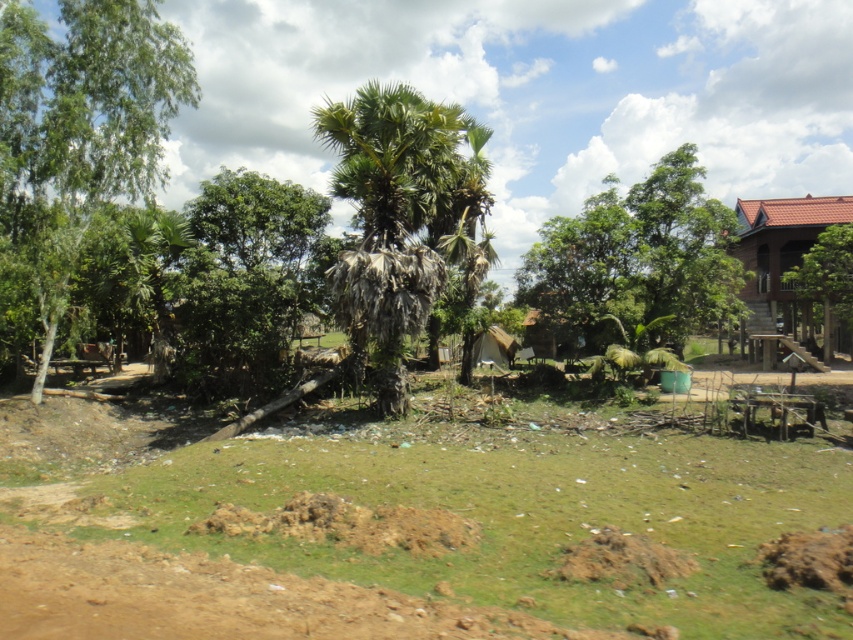
You are standing in the middle of the rural scene and want to walk towards the green leafy tree at right. Which direction should you move relative to the green leafy tree at center?

You should move to the right of the green leafy tree at center because the green leafy tree at right is positioned to the right side of the scene, and since the green leafy tree at center is closer to you, moving right from its position will lead you toward the tree at the right.

You are standing in a rural area and see the brown soil at center and the green leafy tree at left. Which object is located to the east of the other?

The brown soil at center is to the right of green leafy tree at left, so the brown soil at center is east of the green leafy tree at left.

You are standing at the point indicated by point (74, 141) in the image. Looking towards the green leafy tree at left, which direction should you turn to face the wooden structure on the right side of the image?

Since the point (74, 141) indicates the green leafy tree at left, you are already facing the tree. To face the wooden structure on the right side of the image, you should turn to your right.